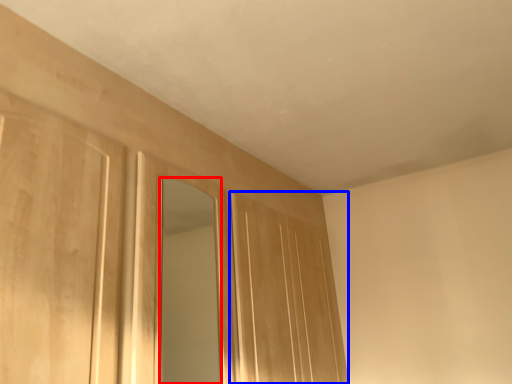
Question: Which point is closer to the camera, mirror (highlighted by a red box) or door (highlighted by a blue box)?

Choices:
 (A) mirror
 (B) door

Answer: (A)